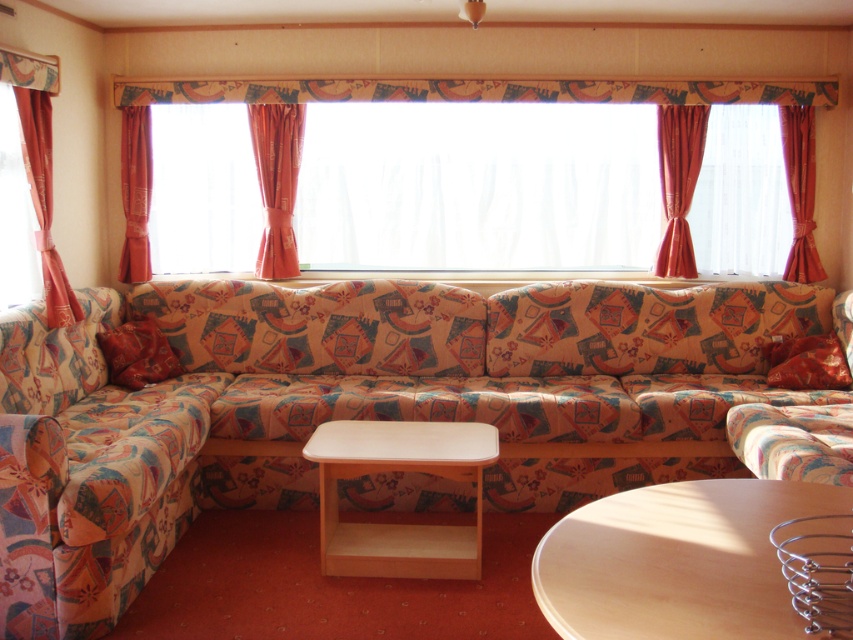
Can you confirm if curtained window at center is shorter than velvet orange curtain at right?

Incorrect, curtained window at center's height does not fall short of velvet orange curtain at right's.

Find the location of a particular element. The height and width of the screenshot is (640, 853). curtained window at center is located at coordinates tap(538, 100).

Is orange fabric curtain at left behind velvet red pillow at lower left?

Yes, orange fabric curtain at left is behind velvet red pillow at lower left.

Is orange fabric curtain at left in front of velvet red pillow at lower left?

No, orange fabric curtain at left is behind velvet red pillow at lower left.

Which is behind, point (126, 276) or point (175, 369)?

Point (126, 276)

Where is `orange fabric curtain at left`? orange fabric curtain at left is located at coordinates (135, 193).

Who is positioned more to the left, light brown wooden table at center or transparent glass window at left?

transparent glass window at left is more to the left.

Which is behind, point (730, 545) or point (1, 260)?

The point (1, 260) is more distant.

Identify the location of light brown wooden table at center. (677, 561).